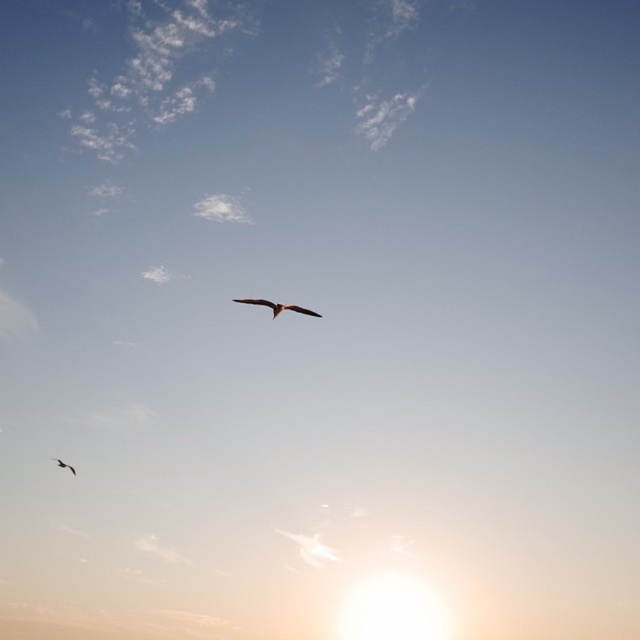
Which is behind, point (275, 317) or point (74, 472)?

Point (74, 472)

Locate an element on the screen. Image resolution: width=640 pixels, height=640 pixels. brown feathered bird at center is located at coordinates (276, 307).

Measure the distance between point (316, 314) and camera.

Point (316, 314) is 102.00 meters away from camera.

At what (x,y) coordinates should I click in order to perform the action: click on brown feathered bird at center. Please return your answer as a coordinate pair (x, y). This screenshot has height=640, width=640. Looking at the image, I should click on (276, 307).